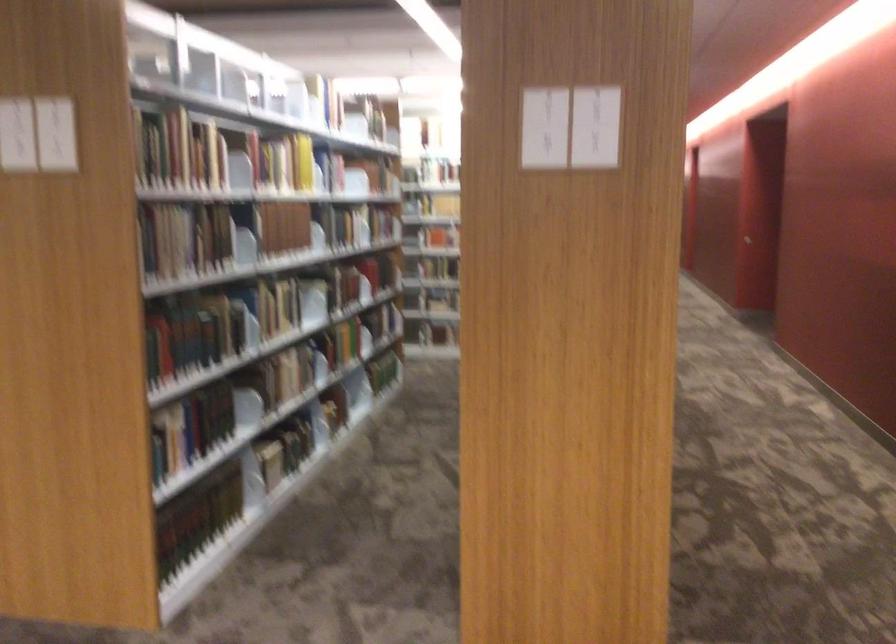
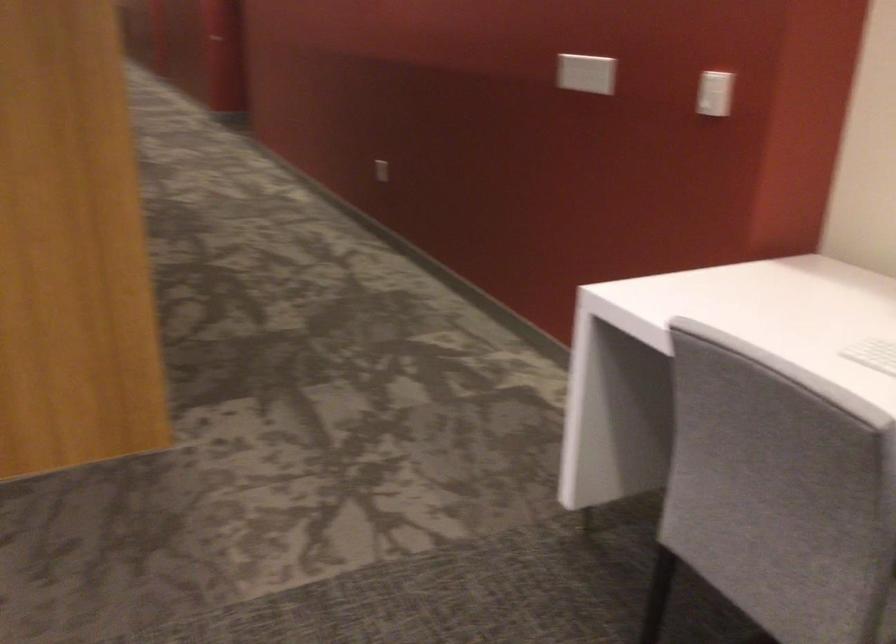
Question: The camera is either moving clockwise (left) or counter-clockwise (right) around the object. The first image is from the beginning of the video and the second image is from the end. Is the camera moving left or right when shooting the video?

Choices:
 (A) Left
 (B) Right

Answer: (A)